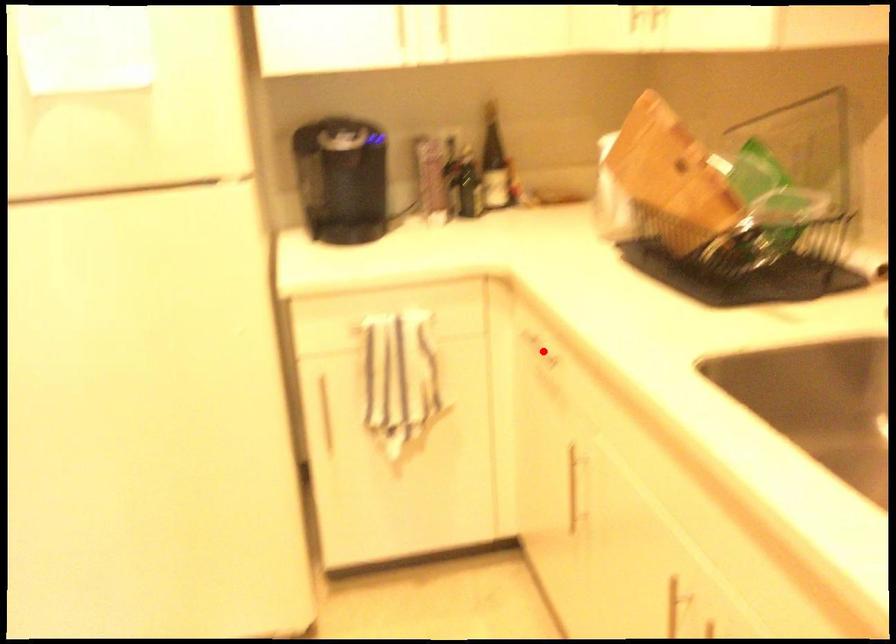
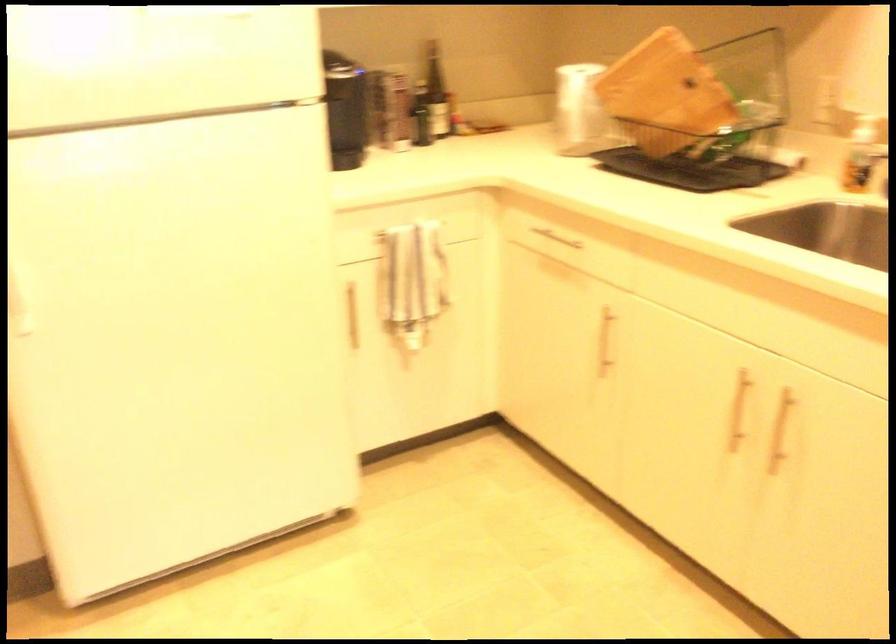
Question: A red point is marked in image1. In image2, is the corresponding 3D point closer to the camera or farther? Reply with the corresponding letter.

Choices:
 (A) The corresponding 3D point is closer.
 (B) The corresponding 3D point is farther.

Answer: (B)